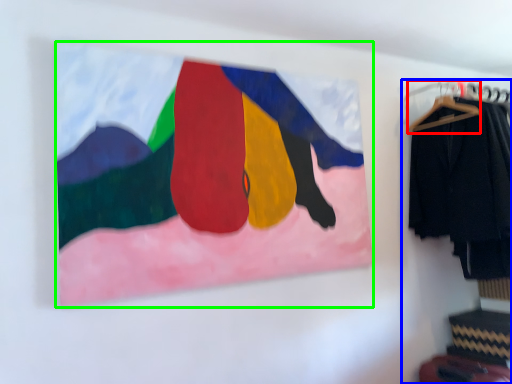
Question: Which object is the closest to the hanger (highlighted by a red box)? Choose among these: closet (highlighted by a blue box) or picture frame (highlighted by a green box).

Choices:
 (A) closet
 (B) picture frame

Answer: (A)